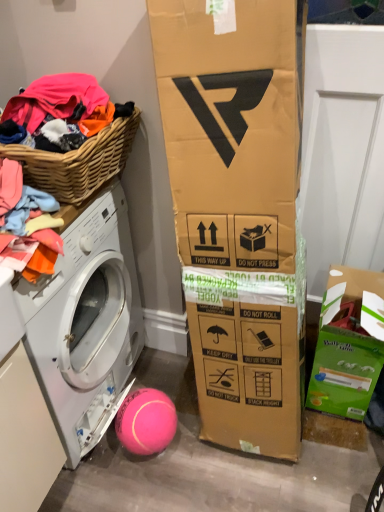
I want to click on empty space that is ontop of pink rubber ball at lower center (from a real-world perspective), so click(145, 408).